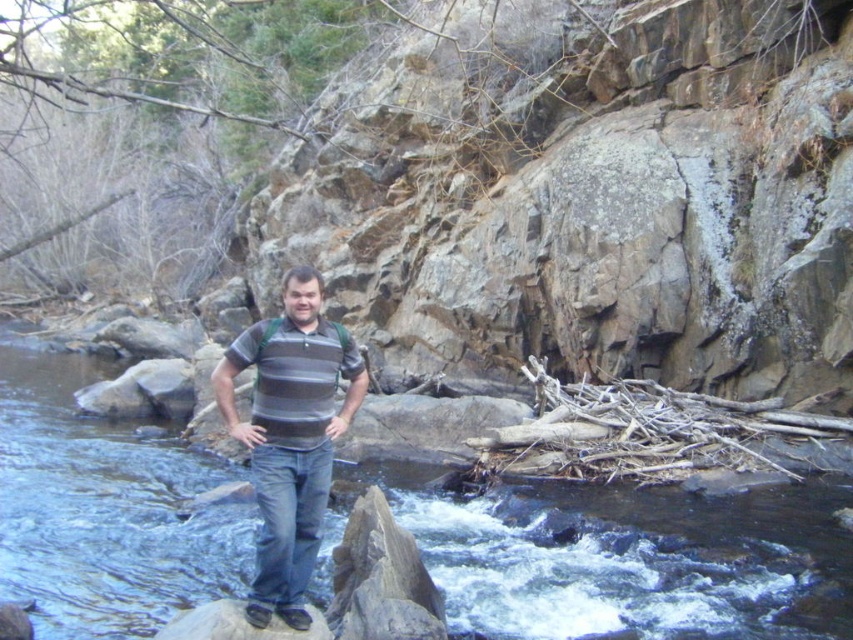
Question: Does clear water at center appear on the left side of striped cotton shirt at center?

Choices:
 (A) yes
 (B) no

Answer: (A)

Question: Is the position of clear water at center less distant than that of striped cotton shirt at center?

Choices:
 (A) yes
 (B) no

Answer: (B)

Question: Among these points, which one is nearest to the camera?

Choices:
 (A) (583, 536)
 (B) (331, 424)

Answer: (B)

Question: Which object appears farthest from the camera in this image?

Choices:
 (A) striped cotton shirt at center
 (B) clear water at center

Answer: (B)

Question: Where is clear water at center located in relation to striped cotton shirt at center in the image?

Choices:
 (A) right
 (B) left

Answer: (B)